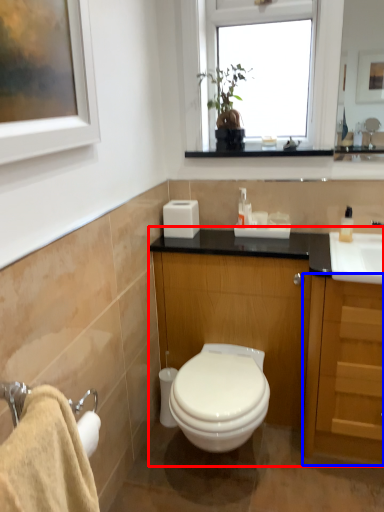
Question: Which object appears farthest to the camera in this image, bathroom cabinet (highlighted by a red box) or cabinetry (highlighted by a blue box)?

Choices:
 (A) bathroom cabinet
 (B) cabinetry

Answer: (A)